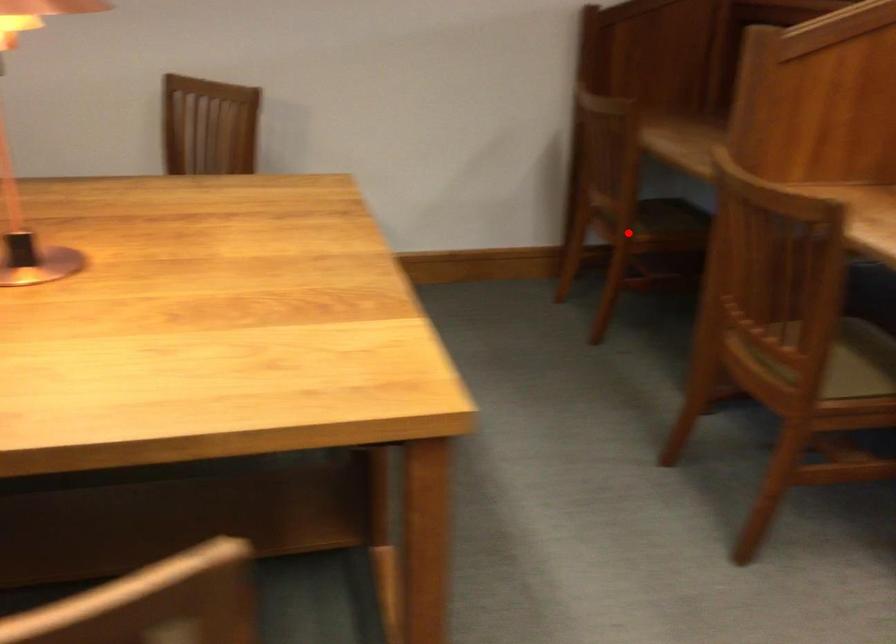
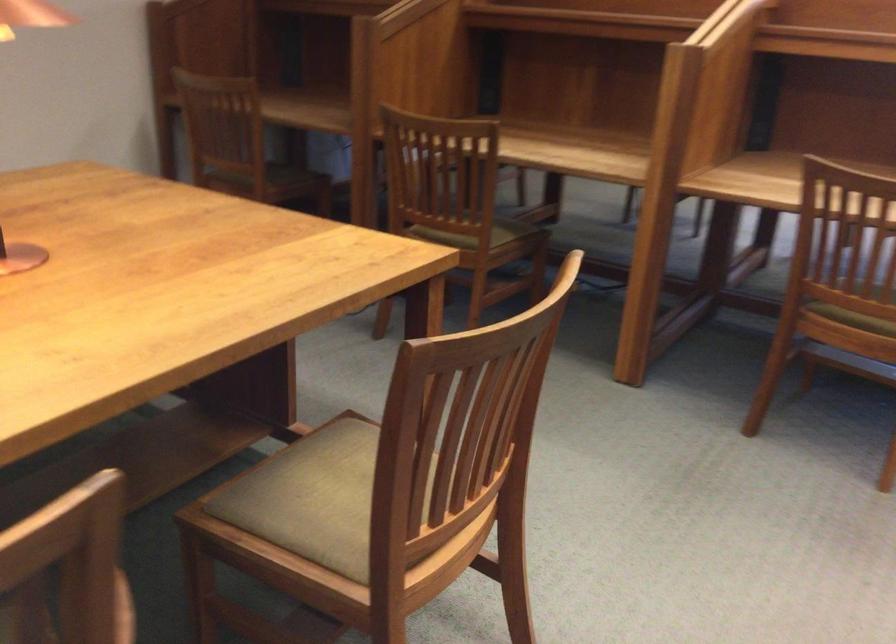
Question: I am providing you with two images of the same scene from different viewpoints. In image1, a red point is highlighted. Considering the same 3D point in image2, which of the following is correct?

Choices:
 (A) It is closer
 (B) It is farther

Answer: (B)